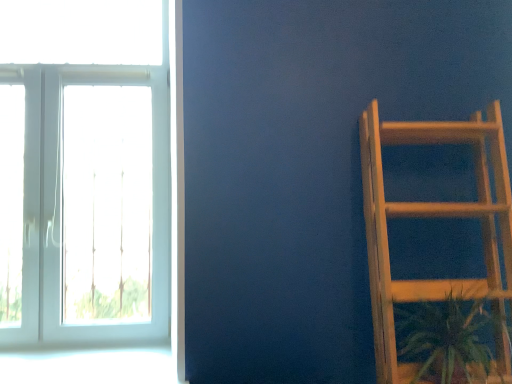
Question: Which is correct: wooden ladder at right is inside green leafy plant at lower right, or outside of it?

Choices:
 (A) inside
 (B) outside

Answer: (B)

Question: From a real-world perspective, relative to green leafy plant at lower right, is wooden ladder at right vertically above or below?

Choices:
 (A) above
 (B) below

Answer: (A)

Question: Which is nearer to the green leafy plant at lower right?

Choices:
 (A) wooden ladder at right
 (B) white glass window at left

Answer: (A)

Question: Which object is the farthest from the wooden ladder at right?

Choices:
 (A) white glass window at left
 (B) green leafy plant at lower right

Answer: (A)